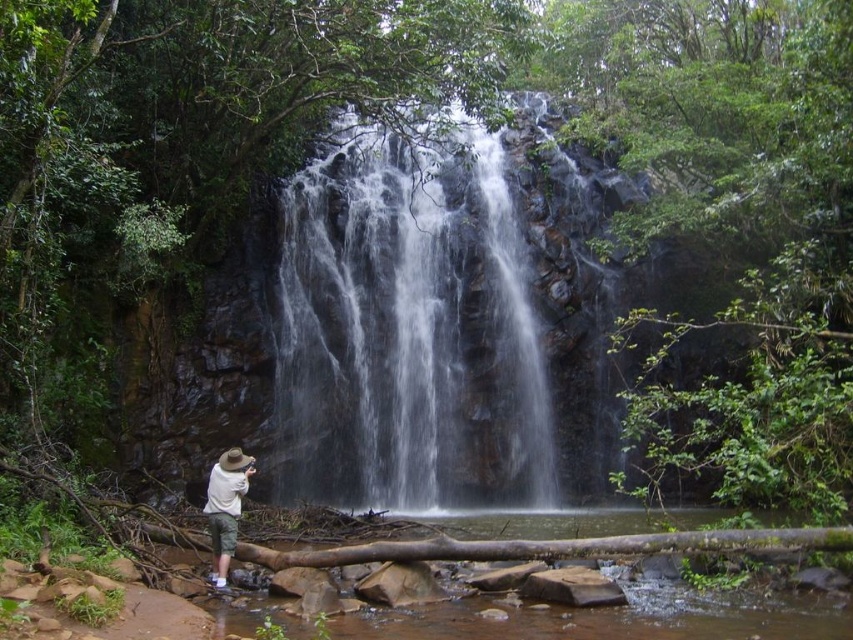
Can you confirm if clear water at center is positioned to the left of white cotton shirt at lower left?

Incorrect, clear water at center is not on the left side of white cotton shirt at lower left.

Image resolution: width=853 pixels, height=640 pixels. In order to click on clear water at center in this screenshot , I will do `click(408, 332)`.

Where is `clear water at center`? clear water at center is located at coordinates (408, 332).